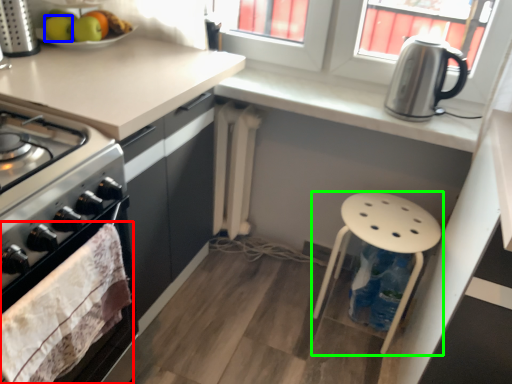
Question: Estimate the real-world distances between objects in this image. Which object is closer to material (highlighted by a red box), apple (highlighted by a blue box) or stool (highlighted by a green box)?

Choices:
 (A) apple
 (B) stool

Answer: (A)